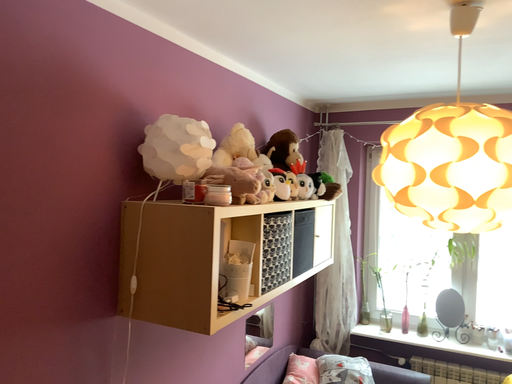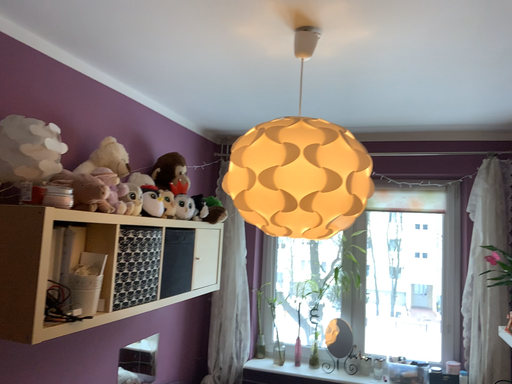
Question: Which way did the camera rotate in the video?

Choices:
 (A) rotated downward
 (B) rotated upward

Answer: (B)